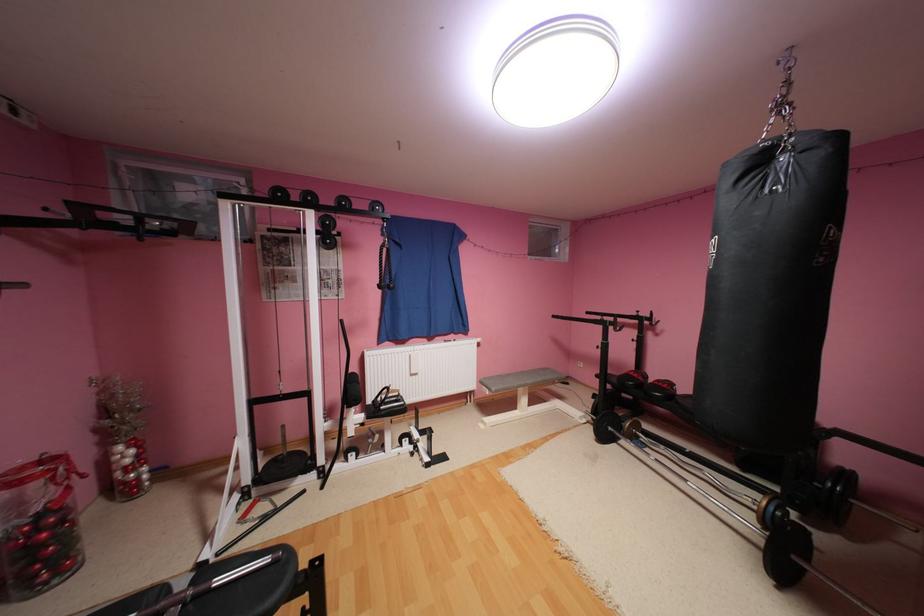
Image resolution: width=924 pixels, height=616 pixels. What do you see at coordinates (383, 265) in the screenshot?
I see `the black pulldown bar` at bounding box center [383, 265].